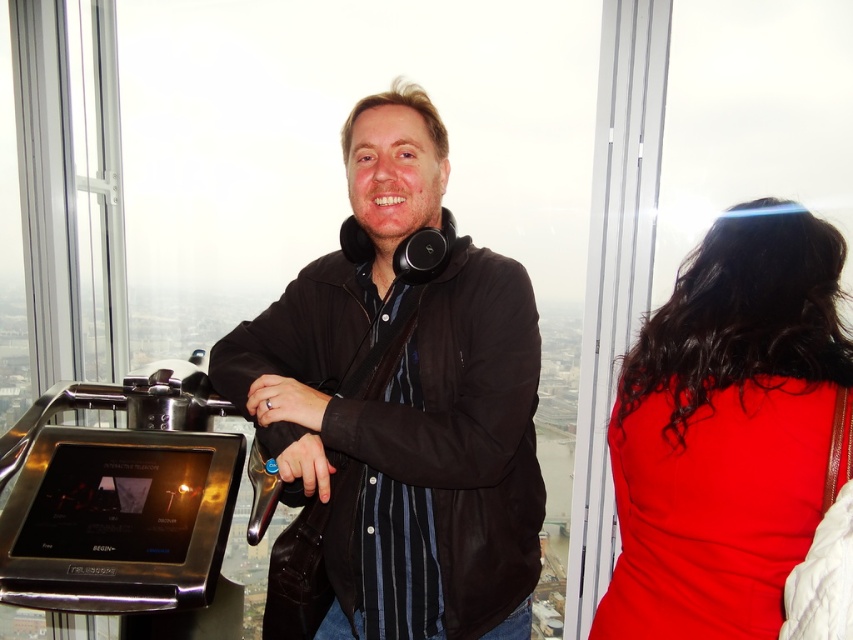
Does black matte jacket at center have a lesser width compared to shiny red dress at right?

Indeed, black matte jacket at center has a lesser width compared to shiny red dress at right.

Image resolution: width=853 pixels, height=640 pixels. Find the location of `black matte jacket at center`. black matte jacket at center is located at coordinates (399, 406).